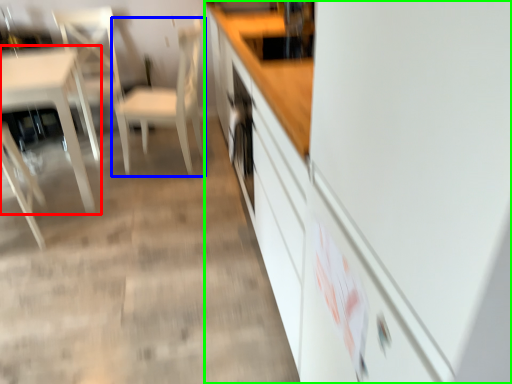
Question: Which object is the closest to the table (highlighted by a red box)? Choose among these: chair (highlighted by a blue box) or cabinetry (highlighted by a green box).

Choices:
 (A) chair
 (B) cabinetry

Answer: (A)